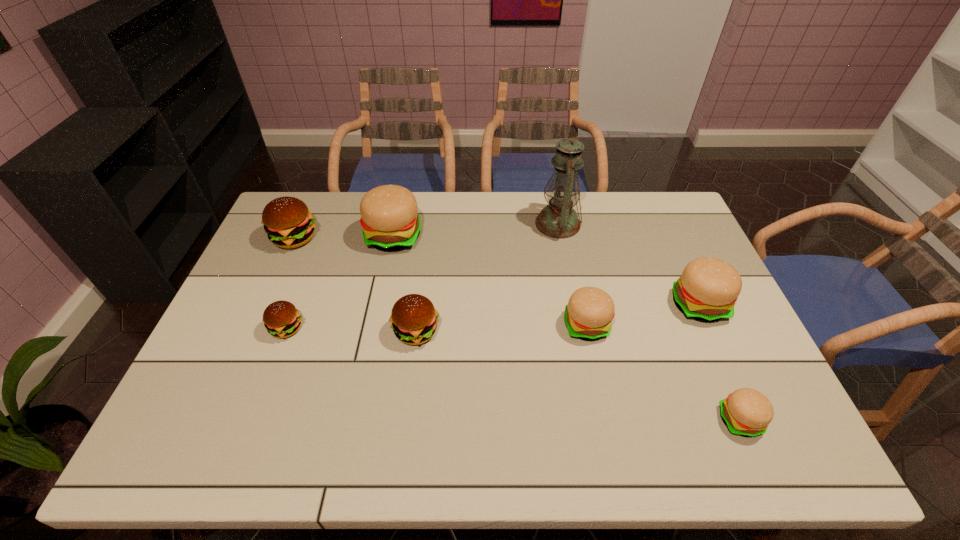
I want to click on the smallest beige hamburger, so click(747, 412).

At what (x,y) coordinates should I click in order to perform the action: click on vacant space situated 0.090m on the back of the oil lamp. Please return your answer as a coordinate pair (x, y). The height and width of the screenshot is (540, 960). Looking at the image, I should click on (552, 192).

The image size is (960, 540). In order to click on free space located 0.100m on the front of the leftmost beige hamburger in this screenshot , I will do `click(385, 279)`.

This screenshot has width=960, height=540. Find the location of `vacant space positioned on the right of the farthest brown hamburger`. vacant space positioned on the right of the farthest brown hamburger is located at coordinates (357, 238).

Find the location of a particular element. The height and width of the screenshot is (540, 960). vacant area located on the left of the third smallest beige hamburger is located at coordinates (541, 305).

At what (x,y) coordinates should I click in order to perform the action: click on free space located on the back of the rightmost brown hamburger. Please return your answer as a coordinate pair (x, y). The image size is (960, 540). Looking at the image, I should click on (421, 287).

Image resolution: width=960 pixels, height=540 pixels. Find the location of `free space located on the front of the third beige hamburger from right to left`. free space located on the front of the third beige hamburger from right to left is located at coordinates (602, 398).

Where is `vacant space located on the right of the smallest brown hamburger`? This screenshot has height=540, width=960. vacant space located on the right of the smallest brown hamburger is located at coordinates [x=391, y=328].

I want to click on vacant space located on the back of the smallest beige hamburger, so click(687, 299).

The height and width of the screenshot is (540, 960). Find the location of `oil lamp at the far edge`. oil lamp at the far edge is located at coordinates (559, 220).